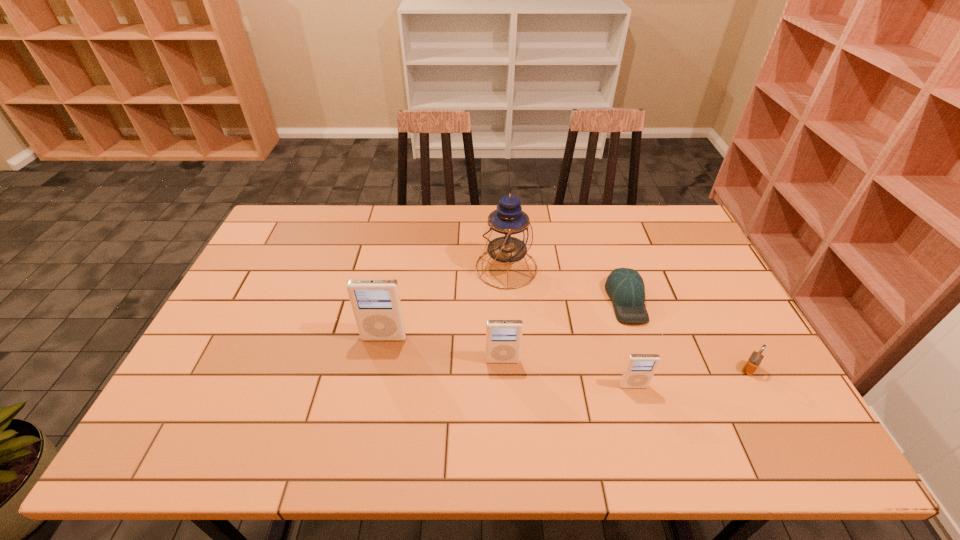
At what (x,y) coordinates should I click in order to perform the action: click on free space at the near edge of the desktop. Please return your answer as a coordinate pair (x, y). This screenshot has width=960, height=540. Looking at the image, I should click on (330, 412).

The width and height of the screenshot is (960, 540). Identify the location of vacant area at the left edge. point(245,345).

The image size is (960, 540). What are the coordinates of `vacant position at the right edge of the desktop` in the screenshot? It's located at (685, 282).

In the image, there is a desktop. Identify the location of free space at the far left corner. (281, 246).

Image resolution: width=960 pixels, height=540 pixels. In the image, there is a desktop. What are the coordinates of `vacant space at the far right corner` in the screenshot? It's located at (668, 228).

At what (x,y) coordinates should I click in order to perform the action: click on unoccupied position between the nearest object and the second iPod from right to left. Please return your answer as a coordinate pair (x, y). Looking at the image, I should click on (568, 374).

The height and width of the screenshot is (540, 960). I want to click on free point between the padlock and the second shortest iPod, so click(x=626, y=365).

Where is `empty location between the padlock and the rightmost iPod`? This screenshot has width=960, height=540. empty location between the padlock and the rightmost iPod is located at coordinates (691, 377).

Identify the location of vacant area that lies between the lantern and the fifth shortest object. The height and width of the screenshot is (540, 960). (445, 303).

Locate an element on the screen. free space between the rightmost iPod and the baseball cap is located at coordinates (630, 343).